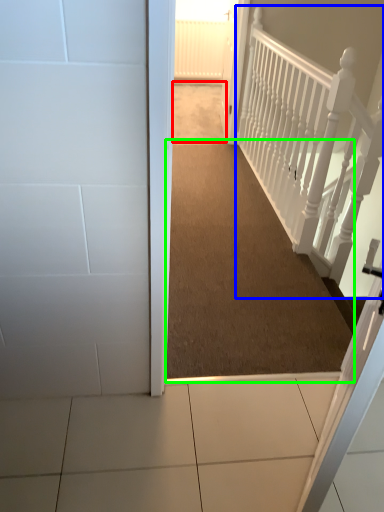
Question: Which object is the closest to the path (highlighted by a red box)? Choose among these: rail (highlighted by a blue box) or corridor (highlighted by a green box).

Choices:
 (A) rail
 (B) corridor

Answer: (A)